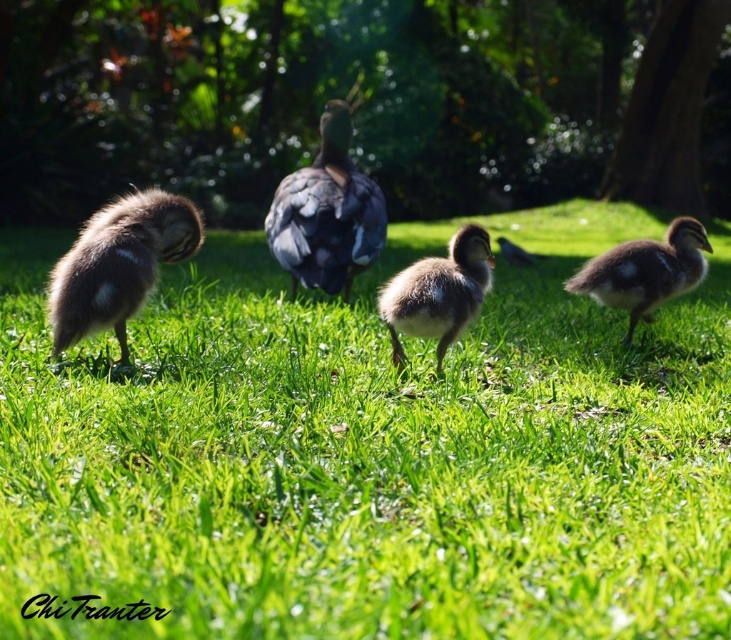
Can you confirm if brown fluffy duckling at right is positioned to the left of dark gray feathers at center?

Correct, you'll find brown fluffy duckling at right to the left of dark gray feathers at center.

Which is above, brown fluffy duckling at right or dark gray feathers at center?

dark gray feathers at center

What do you see at coordinates (645, 272) in the screenshot? The height and width of the screenshot is (640, 731). I see `brown fluffy duckling at right` at bounding box center [645, 272].

Identify the location of brown fluffy duckling at right. The width and height of the screenshot is (731, 640). pos(645,272).

Who is lower down, green soft grass at center or dark gray matte duck at center?

dark gray matte duck at center

Which is behind, point (75, 467) or point (336, 152)?

The point (336, 152) is more distant.

The width and height of the screenshot is (731, 640). I want to click on green soft grass at center, so click(x=371, y=452).

Can you confirm if dark gray matte duck at center is positioned above dark gray feathers at center?

No, dark gray matte duck at center is not above dark gray feathers at center.

Is point (367, 214) positioned in front of point (511, 253)?

Yes, point (367, 214) is in front of point (511, 253).

Where is `dark gray matte duck at center`? The height and width of the screenshot is (640, 731). dark gray matte duck at center is located at coordinates (325, 212).